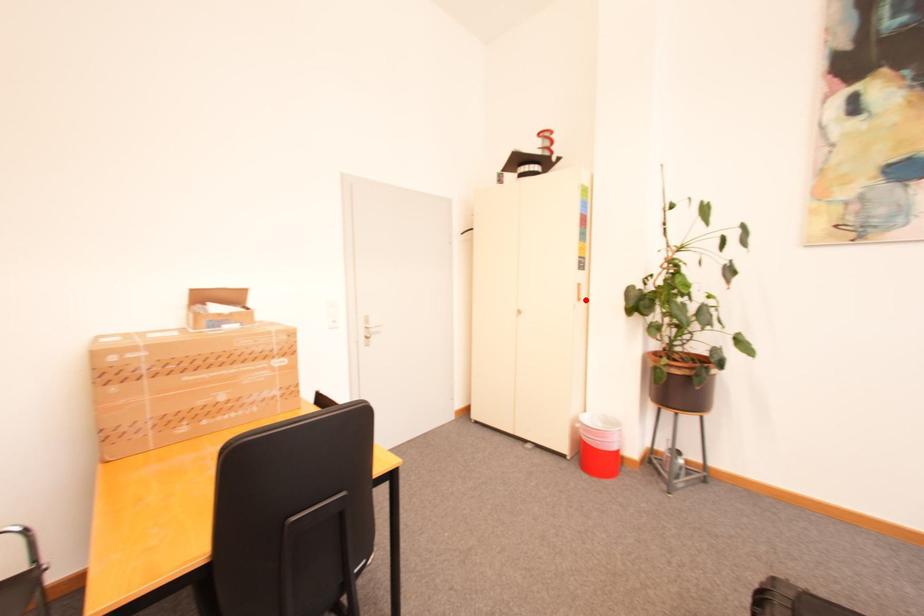
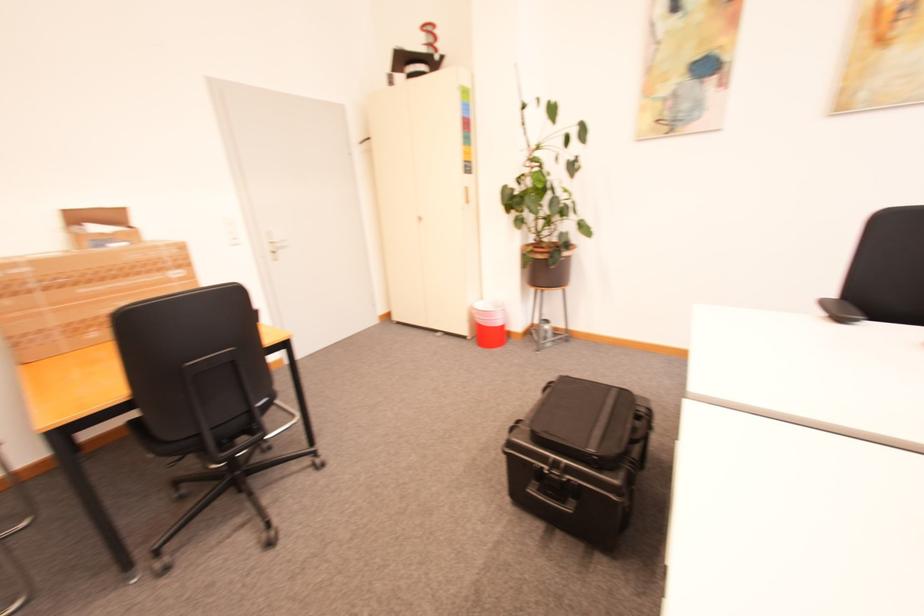
The point at the highlighted location is marked in the first image. Where is the corresponding point in the second image?

(473, 203)